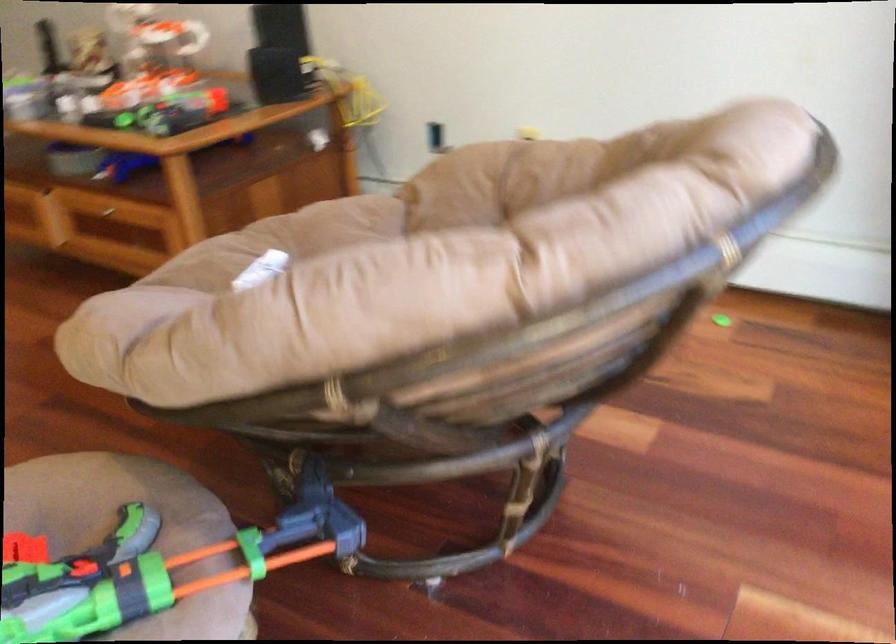
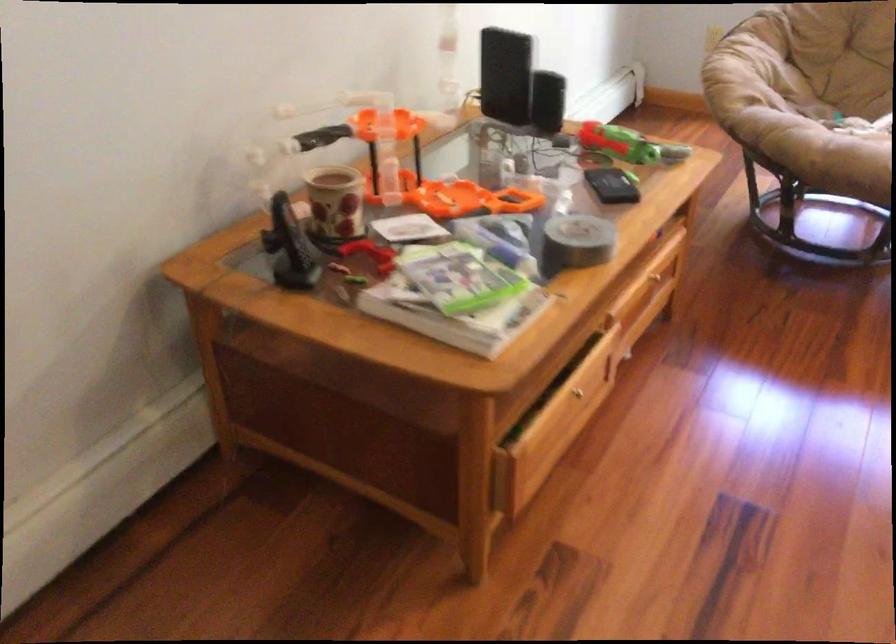
Locate, in the second image, the point that corresponds to (104,111) in the first image.

(613, 185)